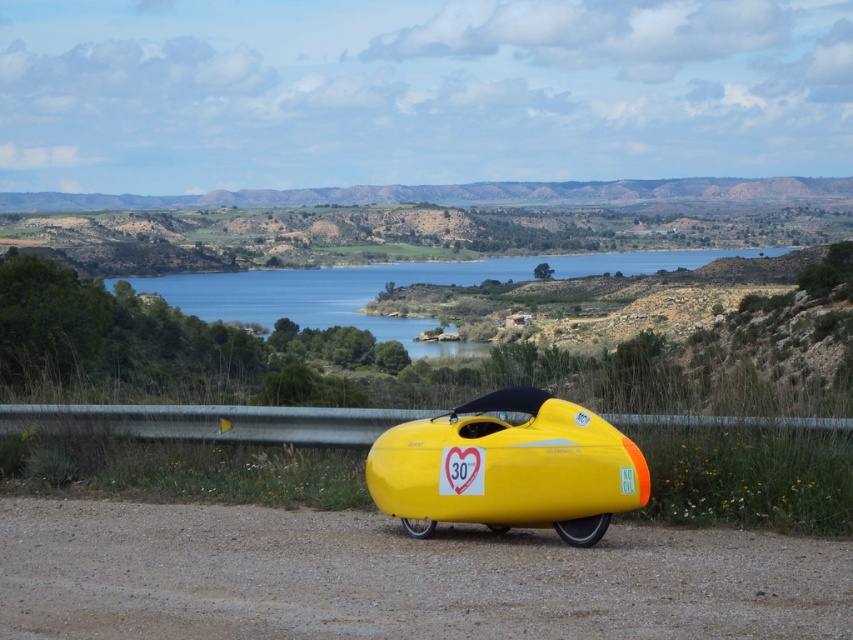
Question: Is yellow matte bicycle at center further to camera compared to blue water at center?

Choices:
 (A) yes
 (B) no

Answer: (B)

Question: Is yellow matte bicycle at lower center positioned before yellow matte bicycle at center?

Choices:
 (A) no
 (B) yes

Answer: (B)

Question: Which is farther from the yellow matte bicycle at center?

Choices:
 (A) yellow matte bicycle at lower center
 (B) blue water at center

Answer: (B)

Question: Does yellow matte bicycle at lower center have a larger size compared to blue water at center?

Choices:
 (A) no
 (B) yes

Answer: (A)

Question: Which object is positioned farthest from the yellow matte bicycle at center?

Choices:
 (A) yellow matte bicycle at lower center
 (B) blue water at center

Answer: (B)

Question: Which object is closer to the camera taking this photo?

Choices:
 (A) yellow matte bicycle at center
 (B) yellow matte bicycle at lower center

Answer: (B)